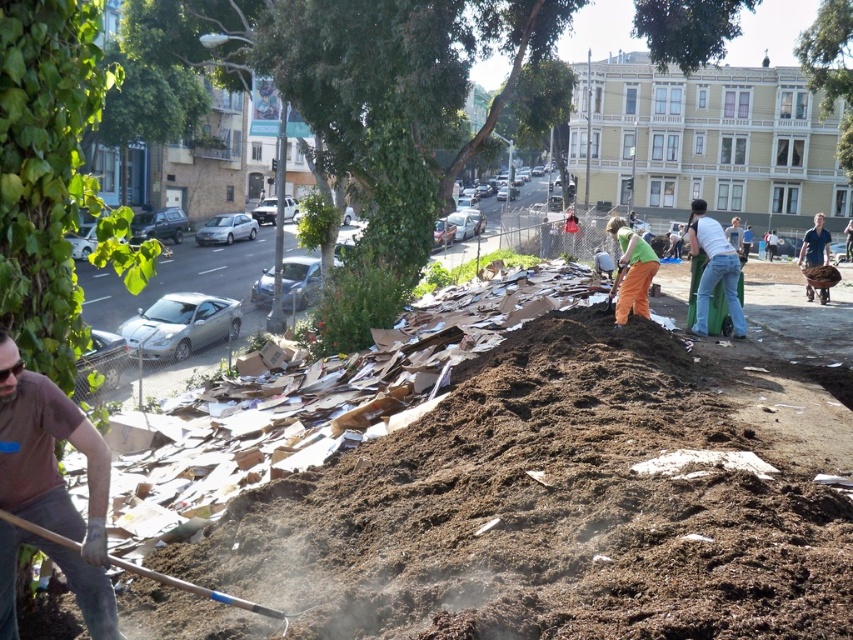
You are a worker at the cleanup site. You need to determine which item is shorter between the brown leather gloves at lower left and the green denim jeans at center. Which one is shorter?

The brown leather gloves at lower left is not as tall as the green denim jeans at center, so the brown leather gloves at lower left is shorter.

You are a construction worker trying to choose between the wooden handle shovel at lower left and the denim jeans at center right for a task that requires a wider tool. Which object should you pick?

The denim jeans at center right is wider than the wooden handle shovel at lower left, so you should pick the denim jeans at center right for the task.